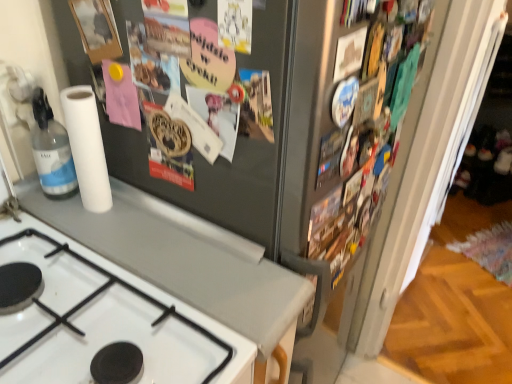
This screenshot has height=384, width=512. Describe the element at coordinates (115, 341) in the screenshot. I see `white glossy gas stove at lower left` at that location.

What is the approximate height of white glossy gas stove at lower left?

white glossy gas stove at lower left is 17.34 centimeters in height.

You are a GUI agent. You are given a task and a screenshot of the screen. Output one action in this format:
    pyautogui.click(x=<x>, y=<y>)
    Task: Click on the white glossy gas stove at lower left
    The image size is (512, 384).
    Given the screenshot: What is the action you would take?
    pyautogui.click(x=115, y=341)

Describe the element at coordinates (87, 147) in the screenshot. The image size is (512, 384). I see `white matte paper towel at left` at that location.

The height and width of the screenshot is (384, 512). What are the coordinates of `white matte paper towel at left` in the screenshot? It's located at (87, 147).

The height and width of the screenshot is (384, 512). What are the coordinates of `white glossy gas stove at lower left` in the screenshot? It's located at (115, 341).

Based on the photo, does white matte paper towel at left appear on the right side of white glossy gas stove at lower left?

Incorrect, white matte paper towel at left is not on the right side of white glossy gas stove at lower left.

Which object is further away from the camera, white matte paper towel at left or white glossy gas stove at lower left?

white matte paper towel at left.

Which point is more forward, (88,179) or (216,330)?

The point (216,330) is in front.

From the image's perspective, is white matte paper towel at left on top of white glossy gas stove at lower left?

Yes, from the image's perspective, white matte paper towel at left is on top of white glossy gas stove at lower left.

From a real-world perspective, is white matte paper towel at left positioned above or below white glossy gas stove at lower left?

In terms of real-world spatial position, white matte paper towel at left is above white glossy gas stove at lower left.

Considering the sizes of objects white matte paper towel at left and white glossy gas stove at lower left in the image provided, who is thinner, white matte paper towel at left or white glossy gas stove at lower left?

white matte paper towel at left.

Who is shorter, white matte paper towel at left or white glossy gas stove at lower left?

Standing shorter between the two is white glossy gas stove at lower left.

Based on the photo, based on their sizes in the image, would you say white matte paper towel at left is bigger or smaller than white glossy gas stove at lower left?

Considering their sizes, white matte paper towel at left takes up less space than white glossy gas stove at lower left.

Is white matte paper towel at left completely or partially outside of white glossy gas stove at lower left?

Yes.

Is white matte paper towel at left far from white glossy gas stove at lower left?

No, there isn't a large distance between white matte paper towel at left and white glossy gas stove at lower left.

Is white matte paper towel at left positioned with its back to white glossy gas stove at lower left?

No, white matte paper towel at left is not facing away from white glossy gas stove at lower left.

The height and width of the screenshot is (384, 512). There is a white glossy gas stove at lower left. Find the location of `paper towel above it (from a real-world perspective)`. paper towel above it (from a real-world perspective) is located at coordinates (87, 147).

Does white glossy gas stove at lower left appear on the left side of white matte paper towel at left?

In fact, white glossy gas stove at lower left is to the right of white matte paper towel at left.

Does white glossy gas stove at lower left come behind white matte paper towel at left?

That is False.

Considering the positions of points (187, 367) and (68, 107), is point (187, 367) farther from camera compared to point (68, 107)?

No, (187, 367) is closer to viewer.

From the image's perspective, is white glossy gas stove at lower left beneath white matte paper towel at left?

Yes, from the image's perspective, white glossy gas stove at lower left is below white matte paper towel at left.

From a real-world perspective, is white glossy gas stove at lower left below white matte paper towel at left?

Yes, from a real-world perspective, white glossy gas stove at lower left is below white matte paper towel at left.

Which of these two, white glossy gas stove at lower left or white matte paper towel at left, is thinner?

white matte paper towel at left is thinner.

Between white glossy gas stove at lower left and white matte paper towel at left, which one has less height?

white glossy gas stove at lower left.

Who is bigger, white glossy gas stove at lower left or white matte paper towel at left?

white glossy gas stove at lower left is bigger.

Consider the image. Is white glossy gas stove at lower left positioned beyond the bounds of white matte paper towel at left?

Yes, white glossy gas stove at lower left is not within white matte paper towel at left.

Is white glossy gas stove at lower left beside white matte paper towel at left?

No, white glossy gas stove at lower left is not next to white matte paper towel at left.

Is white glossy gas stove at lower left oriented towards white matte paper towel at left?

No, white glossy gas stove at lower left does not turn towards white matte paper towel at left.

Can you tell me how much white glossy gas stove at lower left and white matte paper towel at left differ in facing direction?

The angle between the facing direction of white glossy gas stove at lower left and the facing direction of white matte paper towel at left is 0.735 degrees.

Where is `gas stove in front of the white matte paper towel at left`? gas stove in front of the white matte paper towel at left is located at coordinates (115, 341).

This screenshot has width=512, height=384. I want to click on paper towel that appears behind the white glossy gas stove at lower left, so click(87, 147).

Where is `gas stove in front of the white matte paper towel at left`? Image resolution: width=512 pixels, height=384 pixels. gas stove in front of the white matte paper towel at left is located at coordinates [115, 341].